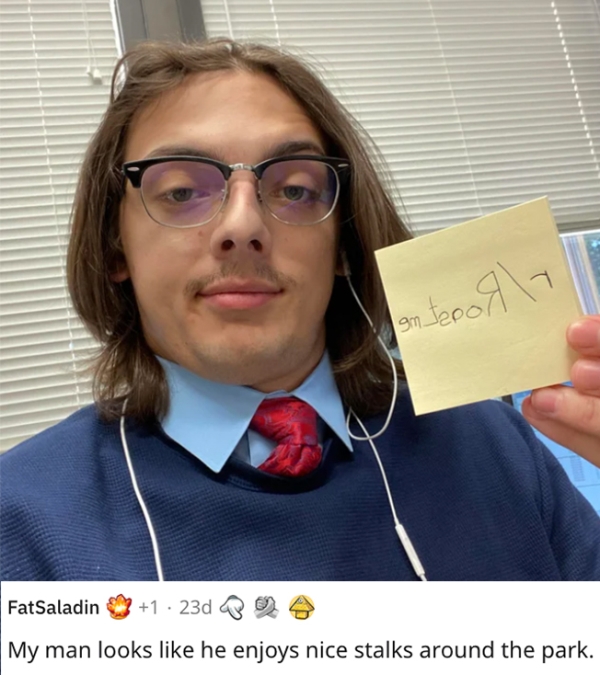
This screenshot has width=600, height=675. I want to click on grey trim between windows, so click(x=158, y=5), click(x=159, y=23).